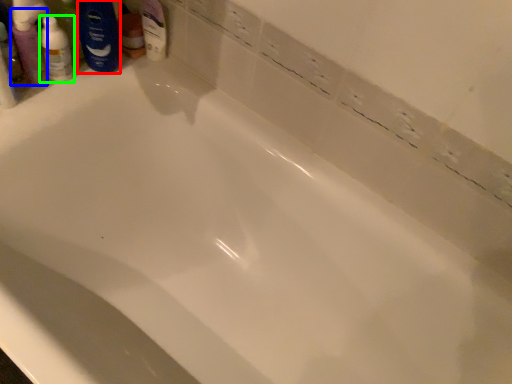
Question: Which object is positioned farthest from shaving cream (highlighted by a red box)? Select from mouthwash (highlighted by a blue box) and toiletry (highlighted by a green box).

Choices:
 (A) mouthwash
 (B) toiletry

Answer: (A)